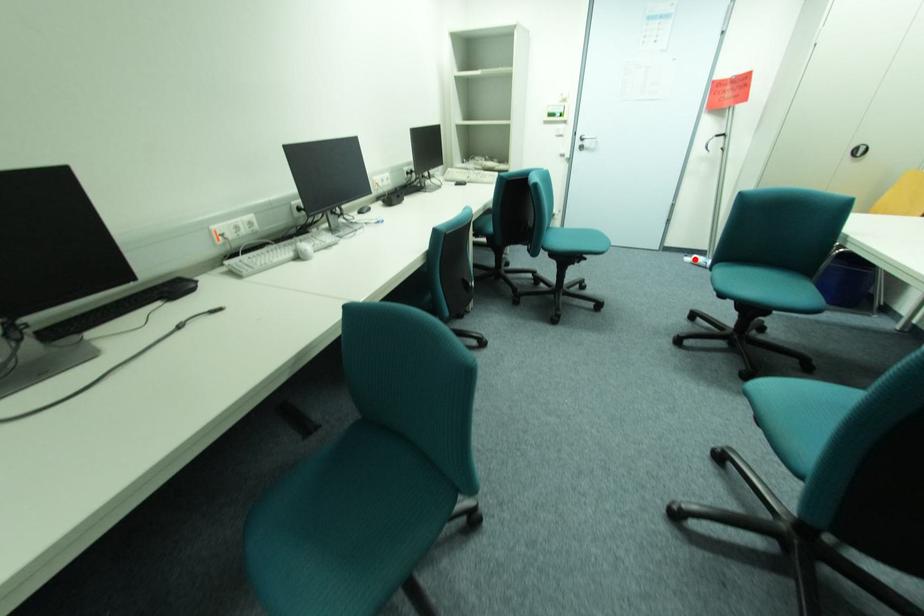
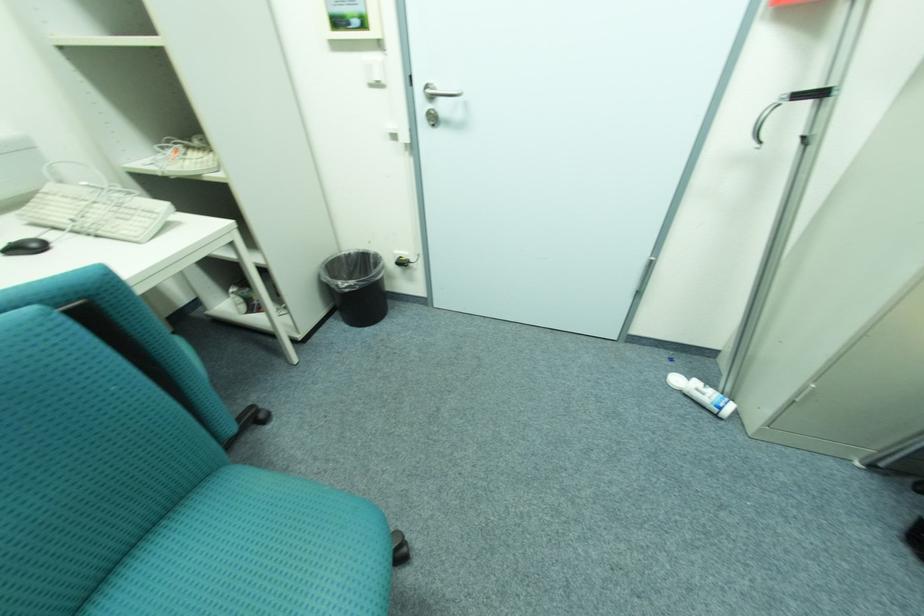
Locate, in the second image, the point that corresponds to the highlighted location in the first image.

(683, 381)